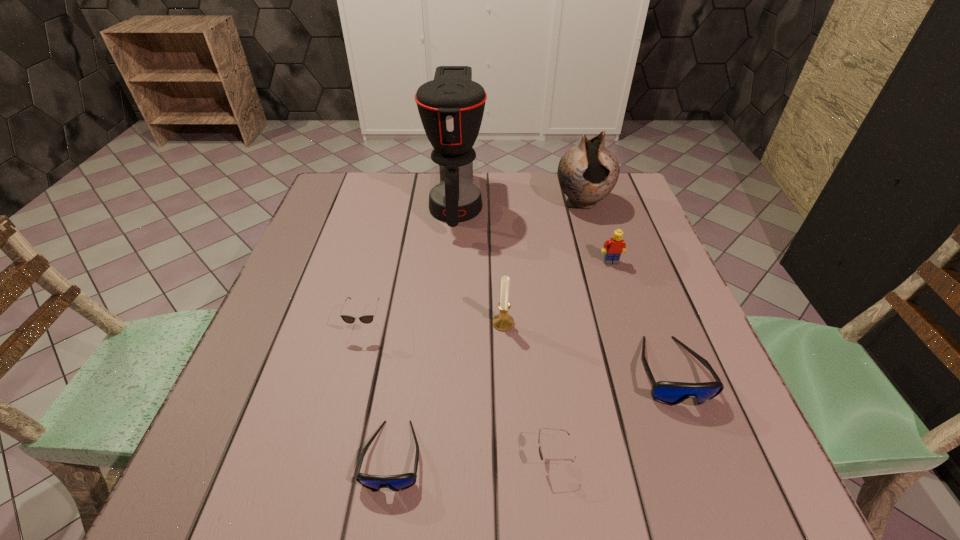
You are a GUI agent. You are given a task and a screenshot of the screen. Output one action in this format:
    pyautogui.click(x=<x>, y=<y>)
    Task: Click on the third sunglasses from left to right
    
    Given the screenshot: What is the action you would take?
    pyautogui.click(x=540, y=452)

This screenshot has width=960, height=540. Identify the location of the fourth object from right to left. (540, 452).

At what (x,y) coordinates should I click in order to perform the action: click on the shortest object. Please return your answer as a coordinate pair (x, y). The image size is (960, 540). Looking at the image, I should click on [x=399, y=482].

The width and height of the screenshot is (960, 540). I want to click on the nearer blue sunglasses, so click(x=399, y=482).

This screenshot has width=960, height=540. What are the coordinates of `vacant space located pour from the carafe of the tallest object` in the screenshot? It's located at (445, 357).

Find the location of a particular element. The width and height of the screenshot is (960, 540). vacant space situated from the spout of the pottery is located at coordinates (604, 273).

You are a GUI agent. You are given a task and a screenshot of the screen. Output one action in this format:
    pyautogui.click(x=<x>, y=<y>)
    Task: Click on the blank space located on the right of the fourth object from left to right
    This screenshot has height=540, width=960.
    Given the screenshot: What is the action you would take?
    pyautogui.click(x=570, y=323)

At what (x,y) coordinates should I click in order to perform the action: click on vacant region located on the front-facing side of the third farthest object. Please return your answer as a coordinate pair (x, y). Image resolution: width=960 pixels, height=540 pixels. Looking at the image, I should click on (643, 359).

Image resolution: width=960 pixels, height=540 pixels. What are the coordinates of `free spot located in front of the lenses of the left black sunglasses` in the screenshot? It's located at (357, 360).

Locate an element on the screen. vacant space located 0.160m on the front-facing side of the rightmost sunglasses is located at coordinates (721, 505).